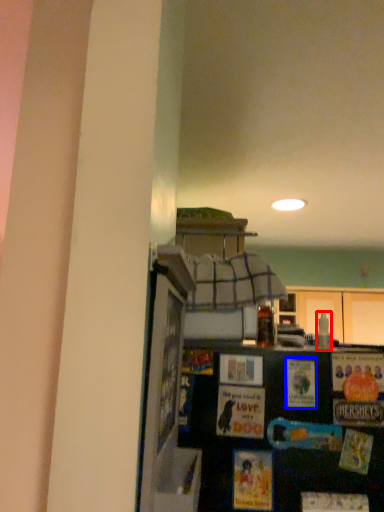
Question: Which of the following is the farthest to the observer, bottle (highlighted by a red box) or postcard (highlighted by a blue box)?

Choices:
 (A) bottle
 (B) postcard

Answer: (A)